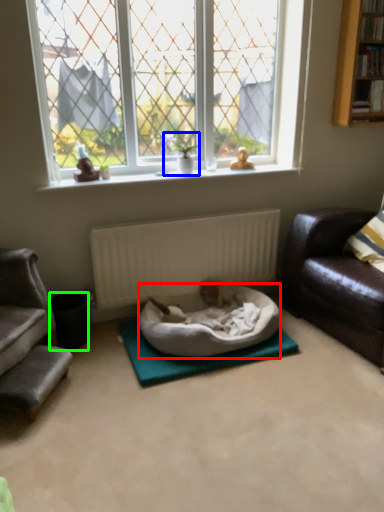
Question: Which is nearer to the dog bed (highlighted by a red box)? houseplant (highlighted by a blue box) or trash bin/can (highlighted by a green box).

Choices:
 (A) houseplant
 (B) trash bin/can

Answer: (B)